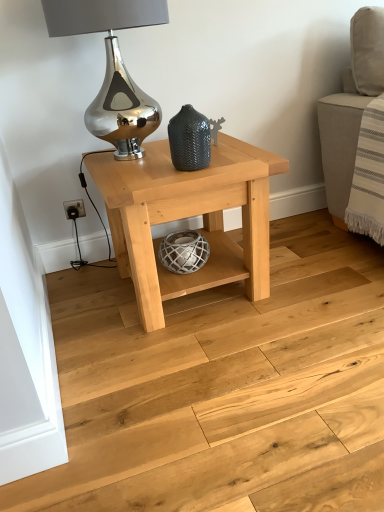
Describe the element at coordinates (224, 388) in the screenshot. Image resolution: width=384 pixels, height=512 pixels. I see `natural wood floor at center` at that location.

Identify the location of shiny metallic table lamp at upper center. The height and width of the screenshot is (512, 384). (113, 68).

Are shiny metallic table lamp at upper center and matte dark gray textured vase at center far apart?

No.

How different are the orientations of shiny metallic table lamp at upper center and matte dark gray textured vase at center in degrees?

They differ by 16.6 degrees in their facing directions.

Considering the relative sizes of shiny metallic table lamp at upper center and matte dark gray textured vase at center in the image provided, is shiny metallic table lamp at upper center wider than matte dark gray textured vase at center?

Indeed, shiny metallic table lamp at upper center has a greater width compared to matte dark gray textured vase at center.

Is natural wood table at center positioned with its back to matte dark gray textured vase at center?

No, natural wood table at center is not facing the opposite direction of matte dark gray textured vase at center.

Is natural wood table at center wider than matte dark gray textured vase at center?

Yes, natural wood table at center is wider than matte dark gray textured vase at center.

Measure the distance between natural wood table at center and matte dark gray textured vase at center.

natural wood table at center is 9.76 inches from matte dark gray textured vase at center.

Can you confirm if natural wood table at center is shorter than matte dark gray textured vase at center?

Incorrect, the height of natural wood table at center does not fall short of that of matte dark gray textured vase at center.

Does natural wood table at center have a greater height compared to natural wood floor at center?

Yes, natural wood table at center is taller than natural wood floor at center.

From the image's perspective, which object appears higher, natural wood table at center or natural wood floor at center?

natural wood table at center.

Is natural wood table at center wider or thinner than natural wood floor at center?

natural wood table at center is thinner than natural wood floor at center.

From a real-world perspective, is matte dark gray textured vase at center on shiny metallic table lamp at upper center?

No, from a real-world perspective, matte dark gray textured vase at center is not on top of shiny metallic table lamp at upper center.

Based on the photo, is matte dark gray textured vase at center touching shiny metallic table lamp at upper center?

No.

Where is `table lamp positioned vertically above the matte dark gray textured vase at center (from a real-world perspective)`? table lamp positioned vertically above the matte dark gray textured vase at center (from a real-world perspective) is located at coordinates (113, 68).

Looking at this image, is matte dark gray textured vase at center aimed at shiny metallic table lamp at upper center?

No.

Is matte dark gray textured vase at center to the left of natural wood floor at center from the viewer's perspective?

Indeed, matte dark gray textured vase at center is positioned on the left side of natural wood floor at center.

From a real-world perspective, between matte dark gray textured vase at center and natural wood floor at center, who is vertically higher?

matte dark gray textured vase at center.

Can you tell me how much matte dark gray textured vase at center and natural wood floor at center differ in facing direction?

116 degrees.

The width and height of the screenshot is (384, 512). Identify the location of vase behind the natural wood floor at center. (189, 139).

Can you confirm if natural wood table at center is wider than shiny metallic table lamp at upper center?

Yes.

Who is shorter, natural wood table at center or shiny metallic table lamp at upper center?

With less height is shiny metallic table lamp at upper center.

Does point (227, 179) appear closer or farther from the camera than point (118, 133)?

Point (227, 179) appears to be closer to the viewer than point (118, 133).

Is natural wood floor at center with natural wood table at center?

There is a gap between natural wood floor at center and natural wood table at center.

Is natural wood floor at center further to camera compared to natural wood table at center?

No.

From the image's perspective, which is above, natural wood floor at center or natural wood table at center?

natural wood table at center is shown above in the image.

In order to click on table lamp above the matte dark gray textured vase at center (from the image's perspective) in this screenshot , I will do `click(113, 68)`.

Image resolution: width=384 pixels, height=512 pixels. Find the location of `table in front of the matte dark gray textured vase at center`. table in front of the matte dark gray textured vase at center is located at coordinates (188, 216).

Based on their spatial positions, is matte dark gray textured vase at center or natural wood table at center further from shiny metallic table lamp at upper center?

natural wood table at center is positioned further to the anchor shiny metallic table lamp at upper center.

Based on their spatial positions, is natural wood table at center or natural wood floor at center closer to shiny metallic table lamp at upper center?

natural wood table at center is positioned closer to the anchor shiny metallic table lamp at upper center.

Considering their positions, is natural wood floor at center positioned closer to natural wood table at center than shiny metallic table lamp at upper center?

Among the two, shiny metallic table lamp at upper center is located nearer to natural wood table at center.

In the scene shown: Based on their spatial positions, is natural wood table at center or matte dark gray textured vase at center further from natural wood floor at center?

matte dark gray textured vase at center.

When comparing their distances from natural wood table at center, does natural wood floor at center or matte dark gray textured vase at center seem further?

natural wood floor at center is positioned further to the anchor natural wood table at center.

Considering their positions, is natural wood table at center positioned further to shiny metallic table lamp at upper center than matte dark gray textured vase at center?

natural wood table at center.

From the image, which object appears to be farther from matte dark gray textured vase at center, shiny metallic table lamp at upper center or natural wood floor at center?

Among the two, natural wood floor at center is located further to matte dark gray textured vase at center.

From the image, which object appears to be nearer to natural wood floor at center, matte dark gray textured vase at center or natural wood table at center?

natural wood table at center.

This screenshot has height=512, width=384. What are the coordinates of `table between shiny metallic table lamp at upper center and natural wood floor at center in the up-down direction` in the screenshot? It's located at (188, 216).

Where is `vase between shiny metallic table lamp at upper center and natural wood floor at center from top to bottom`? vase between shiny metallic table lamp at upper center and natural wood floor at center from top to bottom is located at coordinates coord(189,139).

At what (x,y) coordinates should I click in order to perform the action: click on table positioned between natural wood floor at center and matte dark gray textured vase at center from near to far. Please return your answer as a coordinate pair (x, y). Image resolution: width=384 pixels, height=512 pixels. Looking at the image, I should click on (188, 216).

Find the location of a particular element. vase between shiny metallic table lamp at upper center and natural wood table at center vertically is located at coordinates (189, 139).